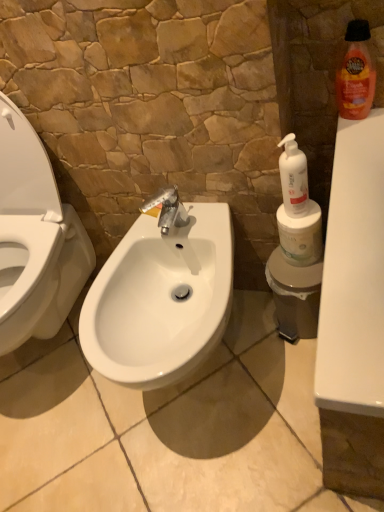
Question: Is white matte toilet paper at right oriented away from white plastic pump bottle at right, arranged as the second cleaning product when viewed from the right?

Choices:
 (A) no
 (B) yes

Answer: (A)

Question: Does white matte toilet paper at right have a greater height compared to white plastic pump bottle at right, which is the first cleaning product in bottom-to-top order?

Choices:
 (A) yes
 (B) no

Answer: (B)

Question: Considering the relative sizes of white matte toilet paper at right and white plastic pump bottle at right, arranged as the second cleaning product when viewed from the right, in the image provided, is white matte toilet paper at right shorter than white plastic pump bottle at right, arranged as the second cleaning product when viewed from the right,?

Choices:
 (A) yes
 (B) no

Answer: (A)

Question: Does white matte toilet paper at right have a larger size compared to white plastic pump bottle at right, marked as the second cleaning product in a top-to-bottom arrangement?

Choices:
 (A) no
 (B) yes

Answer: (B)

Question: Can we say white matte toilet paper at right lies outside white plastic pump bottle at right, which is the first cleaning product in bottom-to-top order?

Choices:
 (A) yes
 (B) no

Answer: (A)

Question: From a real-world perspective, is white plastic pump bottle at right, marked as the second cleaning product in a top-to-bottom arrangement, above or below white glossy bidet at center?

Choices:
 (A) above
 (B) below

Answer: (A)

Question: Is white plastic pump bottle at right, acting as the 1th cleaning product starting from the left, wider or thinner than white glossy bidet at center?

Choices:
 (A) thin
 (B) wide

Answer: (A)

Question: In the image, is white plastic pump bottle at right, marked as the second cleaning product in a top-to-bottom arrangement, on the left side or the right side of white glossy bidet at center?

Choices:
 (A) right
 (B) left

Answer: (A)

Question: From their relative heights in the image, would you say white plastic pump bottle at right, arranged as the second cleaning product when viewed from the right, is taller or shorter than white glossy bidet at center?

Choices:
 (A) short
 (B) tall

Answer: (A)

Question: Choose the correct answer: Is white glossy sink at center inside white glossy bidet at center or outside it?

Choices:
 (A) outside
 (B) inside

Answer: (A)

Question: From a real-world perspective, relative to white glossy bidet at center, is white glossy sink at center vertically above or below?

Choices:
 (A) above
 (B) below

Answer: (B)

Question: Considering the positions of white glossy sink at center and white glossy bidet at center in the image, is white glossy sink at center bigger or smaller than white glossy bidet at center?

Choices:
 (A) small
 (B) big

Answer: (A)

Question: Does point (114, 343) appear closer or farther from the camera than point (79, 224)?

Choices:
 (A) farther
 (B) closer

Answer: (B)

Question: Is white glossy sink at center bigger or smaller than white matte toilet paper at right?

Choices:
 (A) small
 (B) big

Answer: (B)

Question: Is white glossy sink at center in front of or behind white matte toilet paper at right in the image?

Choices:
 (A) behind
 (B) front

Answer: (B)